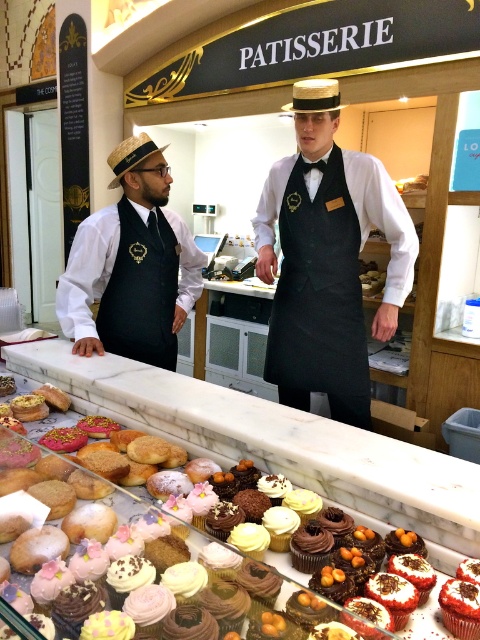
Does matte black vest at left appear on the right side of black fabric apron at left?

Indeed, matte black vest at left is positioned on the right side of black fabric apron at left.

Is matte black vest at left above black fabric apron at left?

Indeed, matte black vest at left is positioned over black fabric apron at left.

Which is in front, point (117, 301) or point (123, 216)?

Positioned in front is point (123, 216).

The image size is (480, 640). Identify the location of matte black vest at left. (132, 266).

Which of these two, black matte apron at center or black fabric apron at left, stands shorter?

black fabric apron at left

Describe the element at coordinates (320, 298) in the screenshot. The height and width of the screenshot is (640, 480). I see `black matte apron at center` at that location.

What are the coordinates of `black matte apron at center` in the screenshot? It's located at (320, 298).

Is matte black vest at left to the right of black matte apron at center from the viewer's perspective?

No, matte black vest at left is not to the right of black matte apron at center.

At what (x,y) coordinates should I click in order to perform the action: click on matte black vest at left. Please return your answer as a coordinate pair (x, y). The image size is (480, 640). Looking at the image, I should click on (132, 266).

Image resolution: width=480 pixels, height=640 pixels. I want to click on matte black vest at left, so click(132, 266).